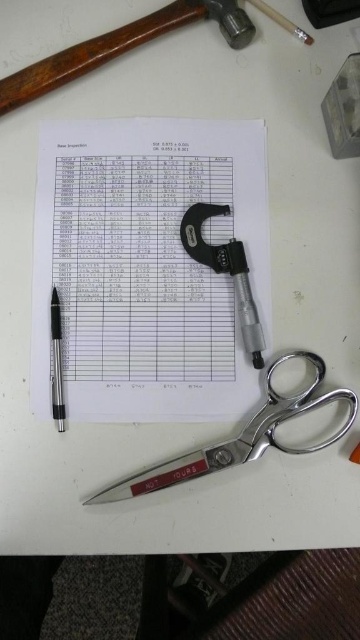
Who is lower down, wooden handle hammer at upper left or metallic silver pen at left?

Positioned lower is metallic silver pen at left.

Is wooden handle hammer at upper left smaller than metallic silver pen at left?

Actually, wooden handle hammer at upper left might be larger than metallic silver pen at left.

Does point (209, 10) come farther from viewer compared to point (59, 316)?

Yes, point (209, 10) is behind point (59, 316).

Where is `wooden handle hammer at upper left`? wooden handle hammer at upper left is located at coordinates (120, 48).

Which is below, white paper at center or silver metallic scissors at lower center?

Positioned lower is silver metallic scissors at lower center.

This screenshot has width=360, height=640. What are the coordinates of `white paper at center` in the screenshot? It's located at (146, 266).

Does point (186, 349) lie in front of point (326, 401)?

No, (186, 349) is further to viewer.

Where is `white paper at center`? This screenshot has height=640, width=360. white paper at center is located at coordinates (146, 266).

Which is above, white paper at center or wooden handle hammer at upper left?

wooden handle hammer at upper left is above.

Between white paper at center and wooden handle hammer at upper left, which one has more height?

Standing taller between the two is white paper at center.

Between point (158, 360) and point (33, 70), which one is positioned behind?

The point (33, 70) is more distant.

You are a GUI agent. You are given a task and a screenshot of the screen. Output one action in this format:
    pyautogui.click(x=<x>, y=<y>)
    Task: Click on the white paper at center
    The width and height of the screenshot is (360, 640).
    Given the screenshot: What is the action you would take?
    pyautogui.click(x=146, y=266)